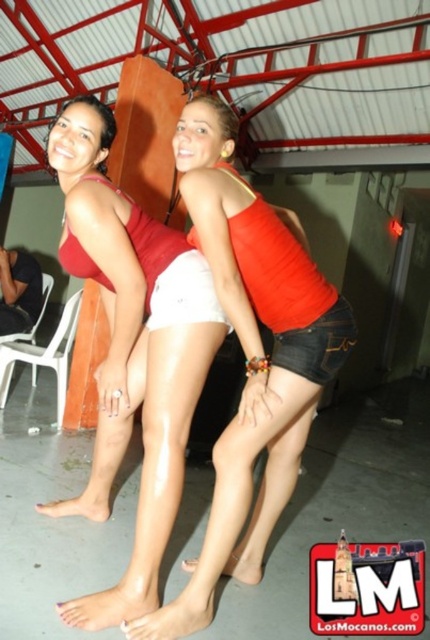
You are a photographer setting up for a group photo. You need to ensure there is enough space between the matte red tank top at center and the white denim shorts at center for proper framing. The minimum required distance for your camera lens is 12 inches. Based on the scene, will the current spacing work?

The distance between the matte red tank top at center and the white denim shorts at center is 11.65 inches, which is slightly less than the required 12 inches. Therefore, the current spacing may not be sufficient for proper framing with your camera lens.

You are organizing a charity event and need to display two pairs of shorts, the white denim shorts at center and the white fabric shorts at center, on a single hanger. The hanger can only hold items that are not significantly different in size. Based on the image, can you place both pairs together on the same hanger?

The white denim shorts at center is bigger than the white fabric shorts at center, so they are significantly different in size and cannot be placed together on the same hanger.